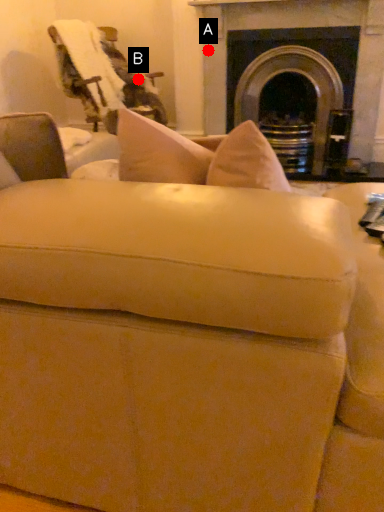
Question: Two points are circled on the image, labeled by A and B beside each circle. Which of the following is the closest to the observer?

Choices:
 (A) A is closer
 (B) B is closer

Answer: (A)